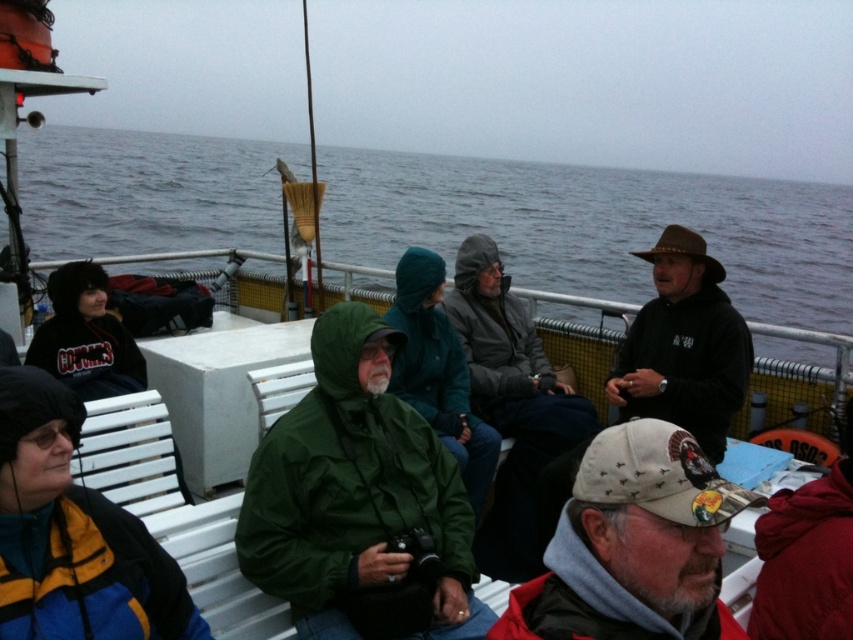
Question: Does red fleece jacket at lower right have a greater width compared to green waterproof jacket at center?

Choices:
 (A) no
 (B) yes

Answer: (A)

Question: Which of the following is the closest to the observer?

Choices:
 (A) red fleece jacket at lower right
 (B) white fabric cap at lower right

Answer: (B)

Question: Does gray water at upper center appear over green matte jacket at center?

Choices:
 (A) yes
 (B) no

Answer: (A)

Question: Can you confirm if gray water at upper center is thinner than green waterproof jacket at center?

Choices:
 (A) yes
 (B) no

Answer: (B)

Question: Which object is closer to the camera taking this photo?

Choices:
 (A) brown leather hat at upper right
 (B) green matte jacket at center
 (C) gray water at upper center

Answer: (B)

Question: Which of the following is the closest to the observer?

Choices:
 (A) (653, 516)
 (B) (662, 289)
 (C) (363, 385)
 (D) (514, 384)

Answer: (A)